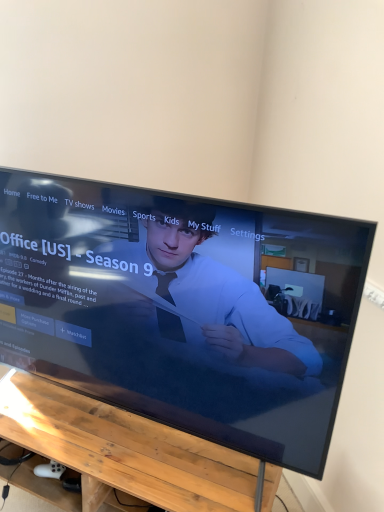
The width and height of the screenshot is (384, 512). Find the location of `black glossy tv at center`. black glossy tv at center is located at coordinates (184, 308).

This screenshot has height=512, width=384. Describe the element at coordinates (184, 308) in the screenshot. I see `black glossy tv at center` at that location.

Find the location of a particular element. The height and width of the screenshot is (512, 384). wooden table at lower center is located at coordinates (124, 450).

What do you see at coordinates (124, 450) in the screenshot? Image resolution: width=384 pixels, height=512 pixels. I see `wooden table at lower center` at bounding box center [124, 450].

Locate an element on the screen. The image size is (384, 512). black glossy tv at center is located at coordinates (184, 308).

Is wooden table at lower center at the right side of black glossy tv at center?

No.

Is wooden table at lower center positioned in front of black glossy tv at center?

No, wooden table at lower center is behind black glossy tv at center.

Which is less distant, (x=33, y=421) or (x=365, y=272)?

Clearly, point (x=33, y=421) is more distant from the camera than point (x=365, y=272).

From the image's perspective, which one is positioned lower, wooden table at lower center or black glossy tv at center?

wooden table at lower center, from the image's perspective.

From a real-world perspective, which is physically below, wooden table at lower center or black glossy tv at center?

In real-world perspective, wooden table at lower center is lower.

Based on the photo, considering the relative sizes of wooden table at lower center and black glossy tv at center in the image provided, is wooden table at lower center thinner than black glossy tv at center?

Incorrect, the width of wooden table at lower center is not less than that of black glossy tv at center.

Between wooden table at lower center and black glossy tv at center, which one has more height?

black glossy tv at center is taller.

Considering the sizes of wooden table at lower center and black glossy tv at center in the image, is wooden table at lower center bigger or smaller than black glossy tv at center?

In the image, wooden table at lower center appears to be smaller than black glossy tv at center.

Is wooden table at lower center positioned beyond the bounds of black glossy tv at center?

Yes, wooden table at lower center is not within black glossy tv at center.

Is wooden table at lower center directly adjacent to black glossy tv at center?

No, wooden table at lower center is not with black glossy tv at center.

Looking at this image, is wooden table at lower center facing towards black glossy tv at center?

No, wooden table at lower center is not aimed at black glossy tv at center.

This screenshot has width=384, height=512. I want to click on furniture on the left of the black glossy tv at center, so click(x=124, y=450).

Between black glossy tv at center and wooden table at lower center, which one appears on the left side from the viewer's perspective?

wooden table at lower center is more to the left.

Is black glossy tv at center in front of wooden table at lower center?

Yes, the depth of black glossy tv at center is less than that of wooden table at lower center.

Does point (281, 464) come farther from viewer compared to point (191, 493)?

Yes, point (281, 464) is farther from viewer.

From the image's perspective, is black glossy tv at center above or below wooden table at lower center?

From the image's perspective, black glossy tv at center appears above wooden table at lower center.

Consider the image. From a real-world perspective, which is physically below, black glossy tv at center or wooden table at lower center?

In real-world perspective, wooden table at lower center is lower.

Between black glossy tv at center and wooden table at lower center, which one has larger width?

With larger width is wooden table at lower center.

Can you confirm if black glossy tv at center is taller than wooden table at lower center?

Correct, black glossy tv at center is much taller as wooden table at lower center.

Looking at this image, is black glossy tv at center bigger or smaller than wooden table at lower center?

In the image, black glossy tv at center appears to be larger than wooden table at lower center.

Would you say black glossy tv at center is inside or outside wooden table at lower center?

black glossy tv at center exists outside the volume of wooden table at lower center.

Would you say black glossy tv at center is a long distance from wooden table at lower center?

No, there isn't a large distance between black glossy tv at center and wooden table at lower center.

Could you tell me if black glossy tv at center is turned towards wooden table at lower center?

No, black glossy tv at center is not oriented towards wooden table at lower center.

The width and height of the screenshot is (384, 512). Find the location of `television above the wooden table at lower center (from the image's perspective)`. television above the wooden table at lower center (from the image's perspective) is located at coordinates (184, 308).

You are a GUI agent. You are given a task and a screenshot of the screen. Output one action in this format:
    pyautogui.click(x=<x>, y=<y>)
    Task: Click on the furniture behind the black glossy tv at center
    
    Given the screenshot: What is the action you would take?
    pyautogui.click(x=124, y=450)

What are the coordinates of `television that is above the wooden table at lower center (from a real-world perspective)` in the screenshot? It's located at (184, 308).